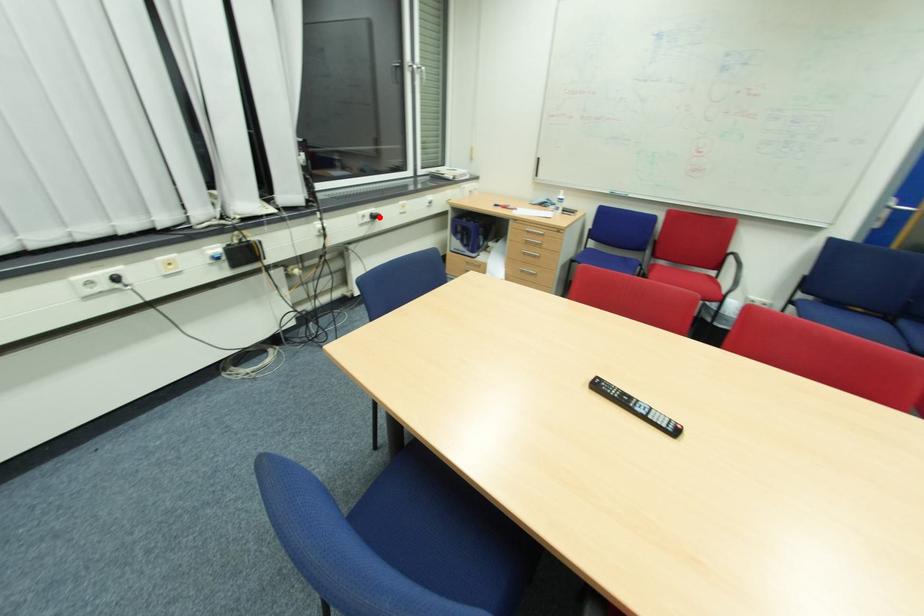
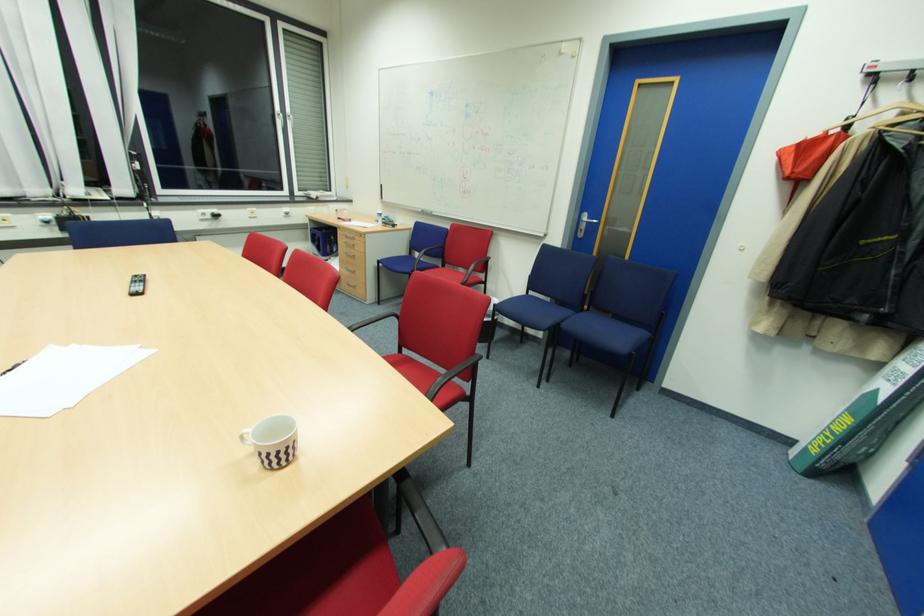
In the second image, find the point that corresponds to the highlighted location in the first image.

(220, 216)